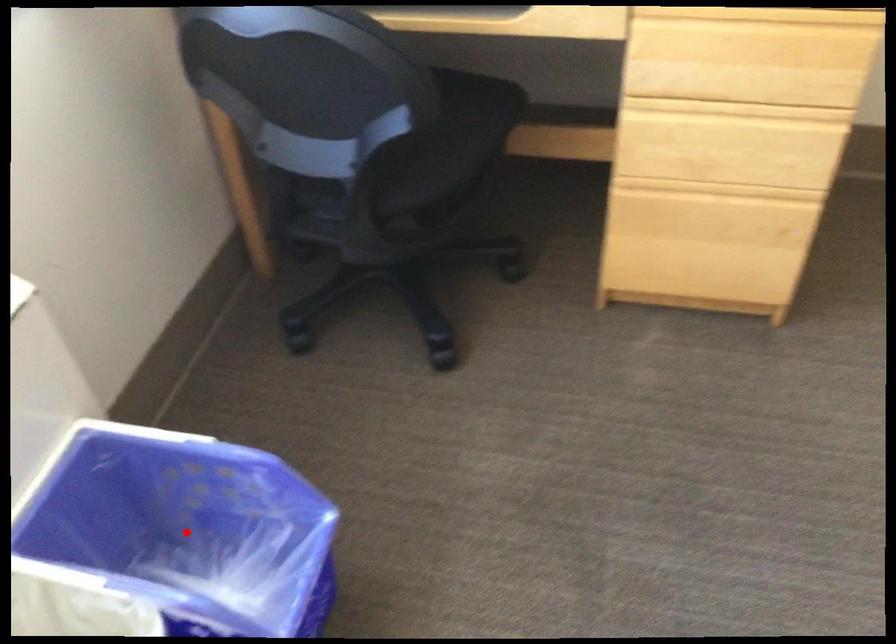
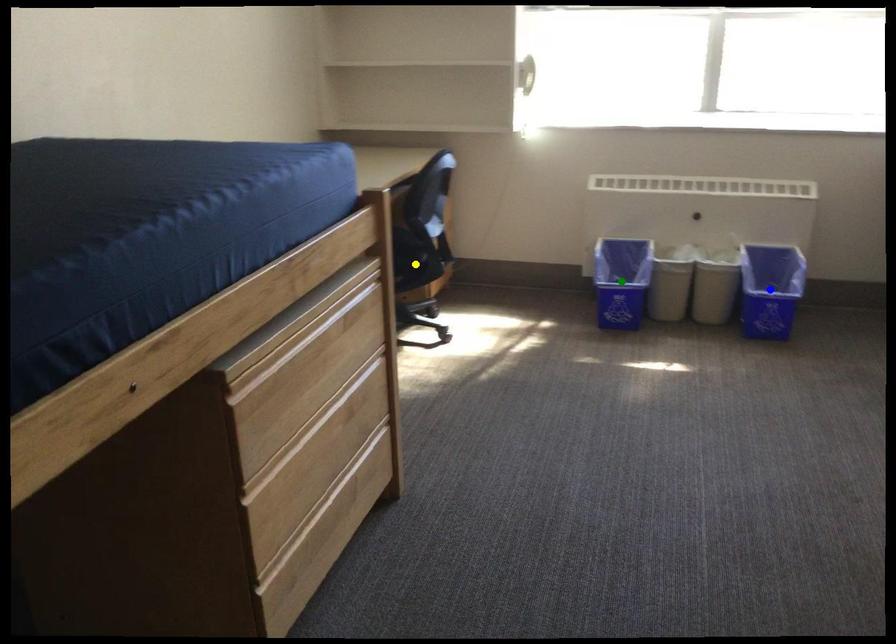
Question: I am providing you with two images of the same scene from different viewpoints. A red point is marked on the first image. You are given multiple points on the second image. In image 2, which mark is for the same physical point as the one in image 1?

Choices:
 (A) green point
 (B) yellow point
 (C) blue point

Answer: (C)